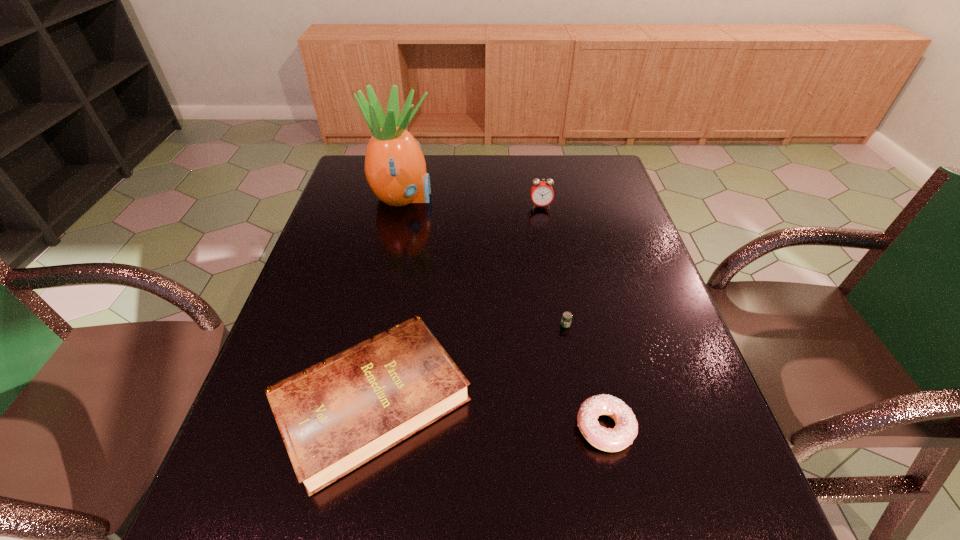
Where is `object that ranks as the second closest to the tallest object`? The width and height of the screenshot is (960, 540). object that ranks as the second closest to the tallest object is located at coordinates (336, 415).

Identify the location of free space that satisfies the following two spatial constraints: 1. at the entrance of the tallest object; 2. on the back side of the shortest object. This screenshot has height=540, width=960. (374, 325).

You are a GUI agent. You are given a task and a screenshot of the screen. Output one action in this format:
    pyautogui.click(x=<x>, y=<y>)
    Task: Click on the vacant space that satisfies the following two spatial constraints: 1. on the back side of the doughnut; 2. at the entrance of the pineapple
    Image resolution: width=960 pixels, height=540 pixels.
    Given the screenshot: What is the action you would take?
    pyautogui.click(x=555, y=198)

The width and height of the screenshot is (960, 540). In order to click on free space in the image that satisfies the following two spatial constraints: 1. at the entrance of the pineapple; 2. on the right side of the hardback book in this screenshot , I will do [358, 401].

Find the location of a particular element. This screenshot has width=960, height=540. blank space that satisfies the following two spatial constraints: 1. on the front-facing side of the shortest object; 2. on the left side of the alarm clock is located at coordinates (561, 325).

The height and width of the screenshot is (540, 960). Identify the location of free space that satisfies the following two spatial constraints: 1. at the entrance of the third tallest object; 2. on the right side of the pineapple. (358, 401).

Find the location of a particular element. This screenshot has height=540, width=960. free spot that satisfies the following two spatial constraints: 1. at the entrance of the doughnut; 2. on the left side of the pineapple is located at coordinates (351, 428).

Where is `blank space that satisfies the following two spatial constraints: 1. at the entrance of the doughnut; 2. on the left side of the pineapple`? This screenshot has height=540, width=960. blank space that satisfies the following two spatial constraints: 1. at the entrance of the doughnut; 2. on the left side of the pineapple is located at coordinates (351, 428).

This screenshot has height=540, width=960. What are the coordinates of `free space that satisfies the following two spatial constraints: 1. at the entrance of the third shortest object; 2. on the right side of the tallest object` in the screenshot? It's located at (358, 401).